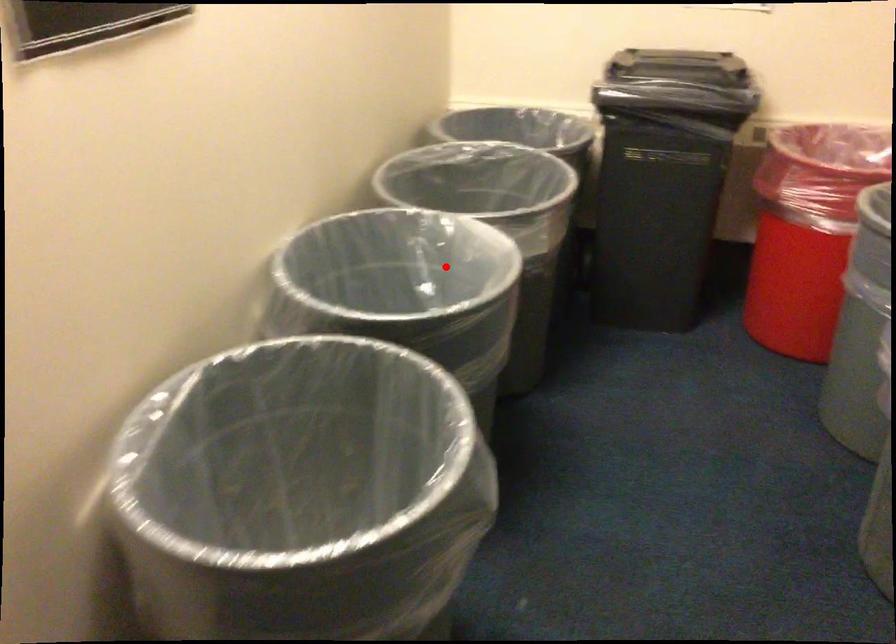
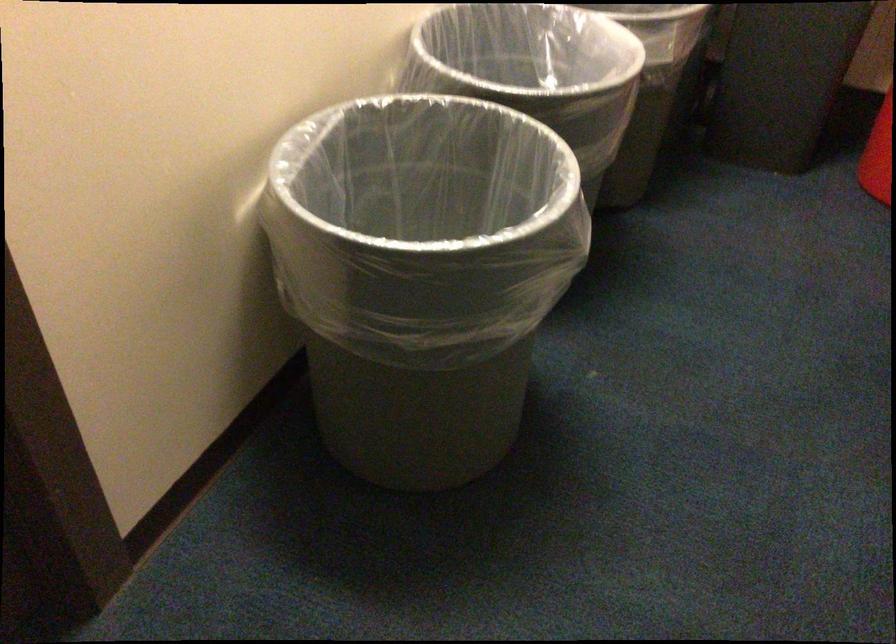
In the second image, find the point that corresponds to the highlighted location in the first image.

(562, 67)